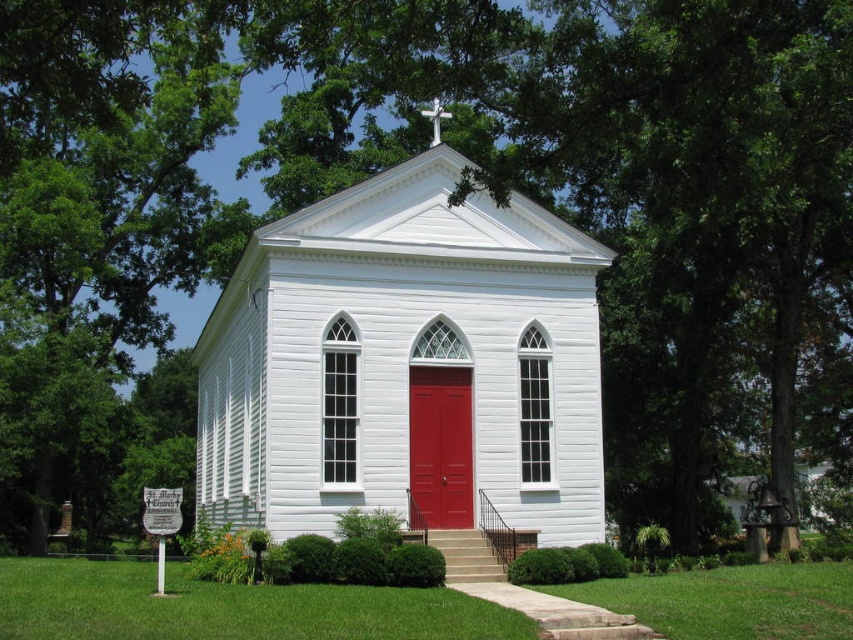
Question: Observing the image, what is the correct spatial positioning of white wood chapel at center in reference to matte wood door at center?

Choices:
 (A) right
 (B) left

Answer: (B)

Question: Does white wood chapel at center have a smaller size compared to matte wood door at center?

Choices:
 (A) no
 (B) yes

Answer: (A)

Question: Which of the following is the closest to the observer?

Choices:
 (A) (517, 349)
 (B) (457, 436)

Answer: (B)

Question: Which of the following is the farthest from the observer?

Choices:
 (A) (535, 252)
 (B) (463, 429)

Answer: (A)

Question: Does white wood chapel at center have a smaller size compared to matte wood door at center?

Choices:
 (A) no
 (B) yes

Answer: (A)